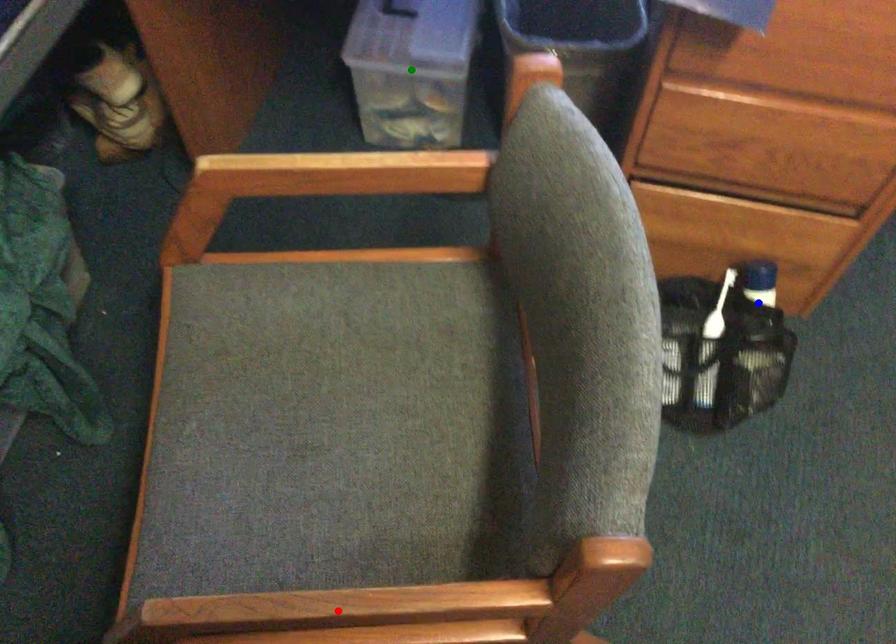
Order these from nearest to farthest:
blue point, red point, green point

green point < blue point < red point